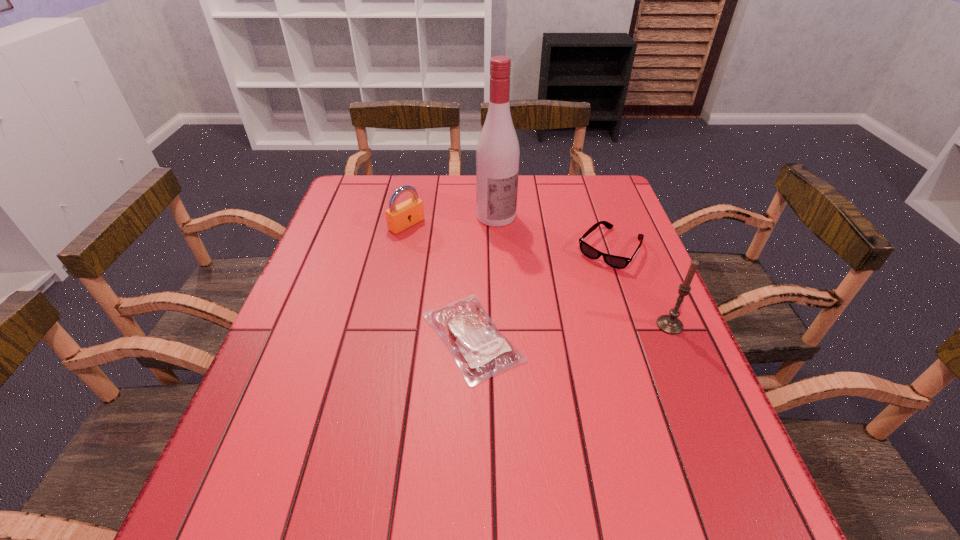
Locate an element on the screen. vacant area that satisfies the following two spatial constraints: 1. on the back side of the second shortest object; 2. on the right side of the steak is located at coordinates (474, 249).

Where is `free space that satisfies the following two spatial constraints: 1. on the back side of the candle; 2. on the left side of the shortest object`? The height and width of the screenshot is (540, 960). free space that satisfies the following two spatial constraints: 1. on the back side of the candle; 2. on the left side of the shortest object is located at coordinates (472, 325).

You are a GUI agent. You are given a task and a screenshot of the screen. Output one action in this format:
    pyautogui.click(x=<x>, y=<y>)
    Task: Click on the vacant region that satisfies the following two spatial constraints: 1. on the front side of the sunglasses; 2. on the right side of the candle
    Image resolution: width=960 pixels, height=540 pixels.
    Given the screenshot: What is the action you would take?
    pyautogui.click(x=636, y=325)